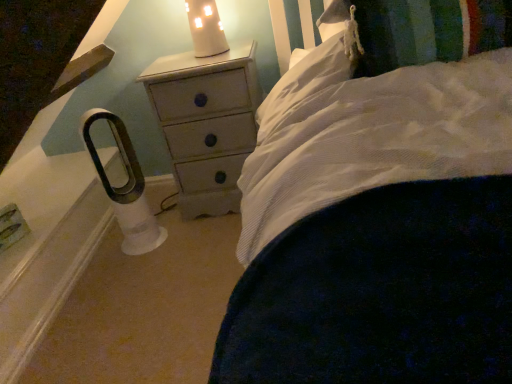
Question: Is white ceramic candle at upper center at the back of white soft pillow at upper right?

Choices:
 (A) no
 (B) yes

Answer: (A)

Question: Considering the relative positions of white soft pillow at upper right and white ceramic candle at upper center in the image provided, is white soft pillow at upper right behind white ceramic candle at upper center?

Choices:
 (A) no
 (B) yes

Answer: (A)

Question: Is the surface of white soft pillow at upper right in direct contact with white ceramic candle at upper center?

Choices:
 (A) no
 (B) yes

Answer: (A)

Question: From the image's perspective, would you say white soft pillow at upper right is positioned over white ceramic candle at upper center?

Choices:
 (A) yes
 (B) no

Answer: (B)

Question: Considering the relative positions of white soft pillow at upper right and white ceramic candle at upper center in the image provided, is white soft pillow at upper right to the left of white ceramic candle at upper center from the viewer's perspective?

Choices:
 (A) yes
 (B) no

Answer: (B)

Question: From the image's perspective, is white soft pillow at upper right located above or below white ceramic candle at upper center?

Choices:
 (A) above
 (B) below

Answer: (B)

Question: Is white soft pillow at upper right to the left or to the right of white ceramic candle at upper center in the image?

Choices:
 (A) right
 (B) left

Answer: (A)

Question: Considering their positions, is white soft pillow at upper right located in front of or behind white ceramic candle at upper center?

Choices:
 (A) front
 (B) behind

Answer: (A)

Question: Considering the positions of white soft pillow at upper right and white ceramic candle at upper center in the image, is white soft pillow at upper right taller or shorter than white ceramic candle at upper center?

Choices:
 (A) tall
 (B) short

Answer: (B)

Question: In the image, is white painted wood chest of drawers at center positioned in front of or behind white soft pillow at upper right?

Choices:
 (A) behind
 (B) front

Answer: (A)

Question: Is white painted wood chest of drawers at center to the left or to the right of white soft pillow at upper right in the image?

Choices:
 (A) right
 (B) left

Answer: (B)

Question: Is white painted wood chest of drawers at center bigger or smaller than white soft pillow at upper right?

Choices:
 (A) small
 (B) big

Answer: (B)

Question: From the image's perspective, is white painted wood chest of drawers at center positioned above or below white soft pillow at upper right?

Choices:
 (A) below
 (B) above

Answer: (A)

Question: Considering the positions of white ceramic candle at upper center and white painted wood chest of drawers at center in the image, is white ceramic candle at upper center taller or shorter than white painted wood chest of drawers at center?

Choices:
 (A) short
 (B) tall

Answer: (A)

Question: Based on their positions, is white ceramic candle at upper center located to the left or right of white painted wood chest of drawers at center?

Choices:
 (A) right
 (B) left

Answer: (B)